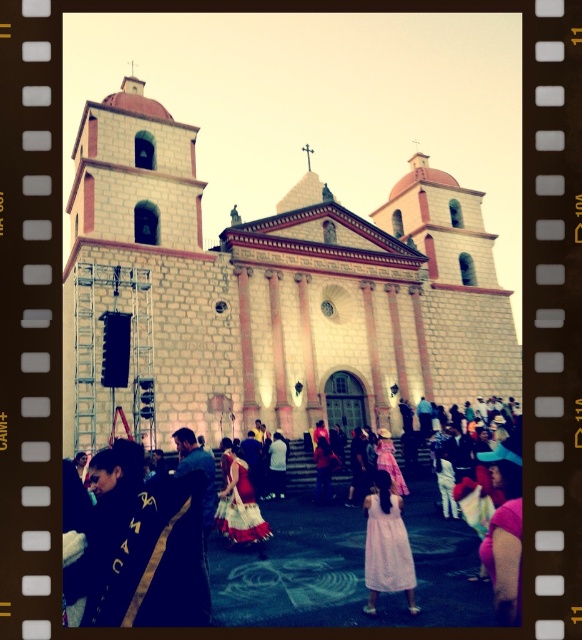
Question: Can you confirm if matte pink dress at center is smaller than red satin dress at center?

Choices:
 (A) yes
 (B) no

Answer: (B)

Question: Is beige stone church at center below matte pink dress at center?

Choices:
 (A) yes
 (B) no

Answer: (B)

Question: Is the position of beige stone church at center less distant than that of plaid fabric dress at center?

Choices:
 (A) yes
 (B) no

Answer: (B)

Question: Which point appears closest to the camera in this image?

Choices:
 (A) (406, 531)
 (B) (243, 461)
 (C) (463, 611)

Answer: (C)

Question: Which object is the closest to the plaid fabric dress at center?

Choices:
 (A) beige stone church at center
 (B) matte pink dress at center

Answer: (B)

Question: Which of the following is the farthest from the observer?

Choices:
 (A) (473, 224)
 (B) (402, 529)

Answer: (A)